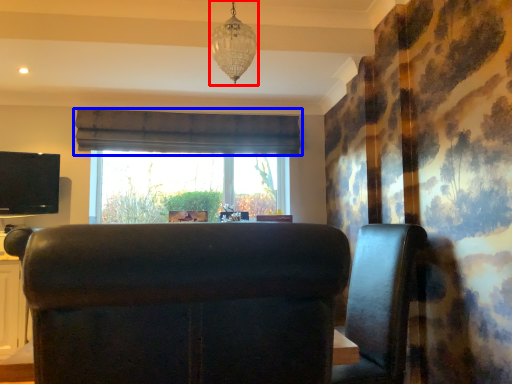
Question: Which of the following is the closest to the observer, lamp (highlighted by a red box) or curtain (highlighted by a blue box)?

Choices:
 (A) lamp
 (B) curtain

Answer: (A)